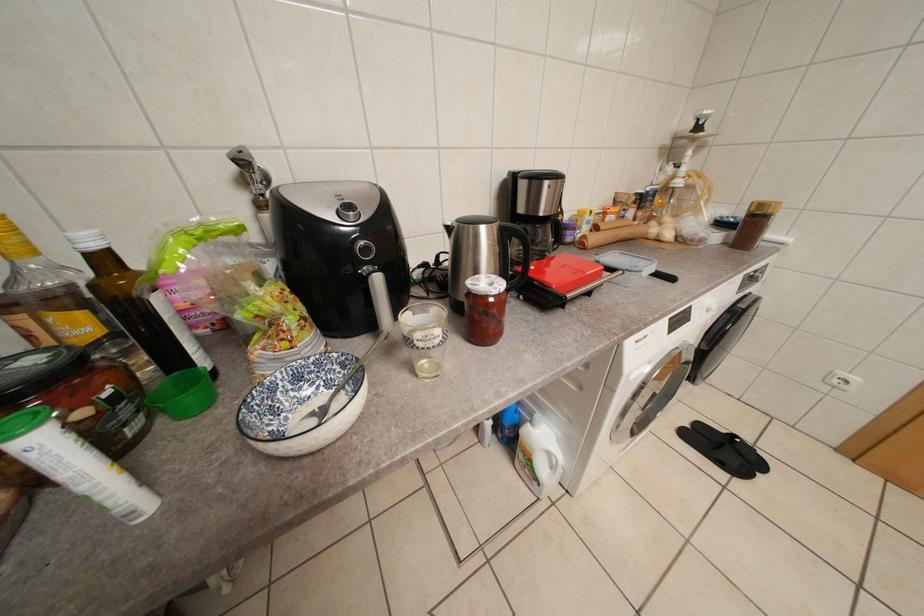
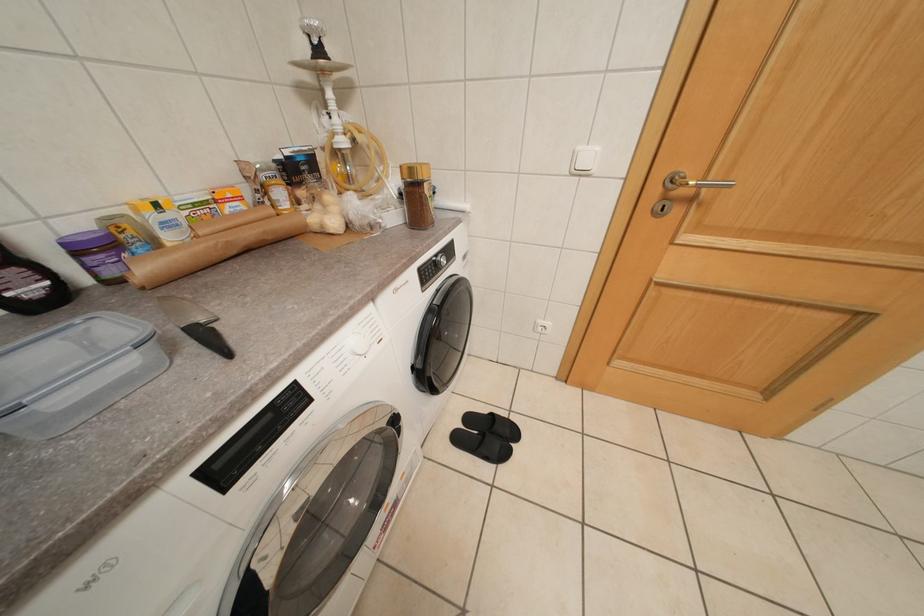
Question: The images are taken continuously from a first-person perspective. In which direction is your viewpoint rotating?

Choices:
 (A) Left
 (B) Right
 (C) Up
 (D) Down

Answer: (B)